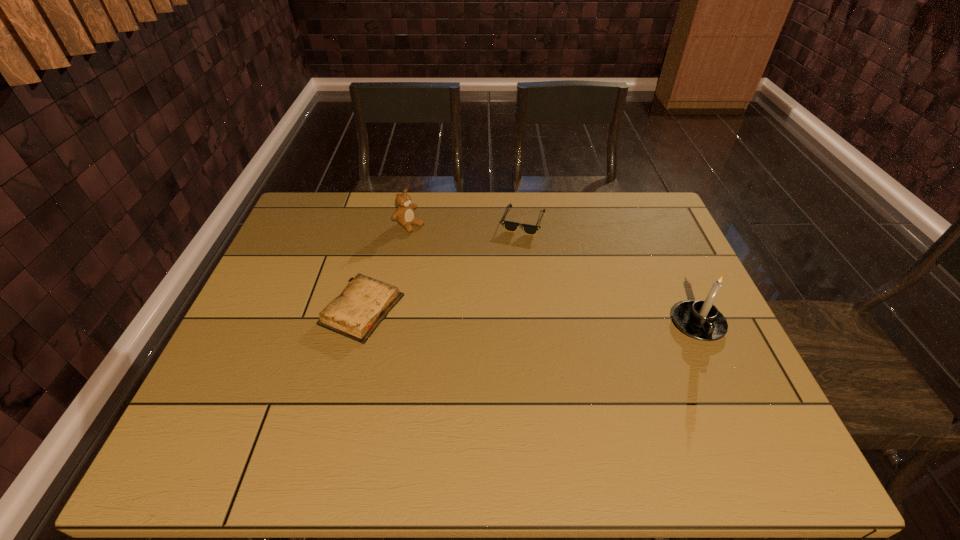
Image resolution: width=960 pixels, height=540 pixels. What are the coordinates of `vacant spot on the desktop that is between the diary and the candle holder and is positioned on the lenses of the sunglasses` in the screenshot? It's located at (568, 319).

In order to click on free spot on the desktop that is between the diary and the rightmost object and is positioned on the front-facing side of the second tallest object in this screenshot , I will do `click(556, 318)`.